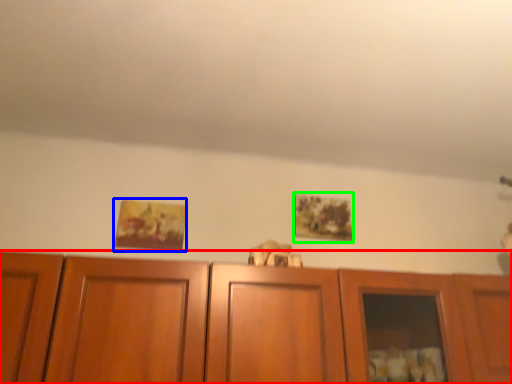
Question: Considering the real-world distances, which object is closest to cabinetry (highlighted by a red box)? picture frame (highlighted by a blue box) or picture frame (highlighted by a green box).

Choices:
 (A) picture frame
 (B) picture frame

Answer: (B)